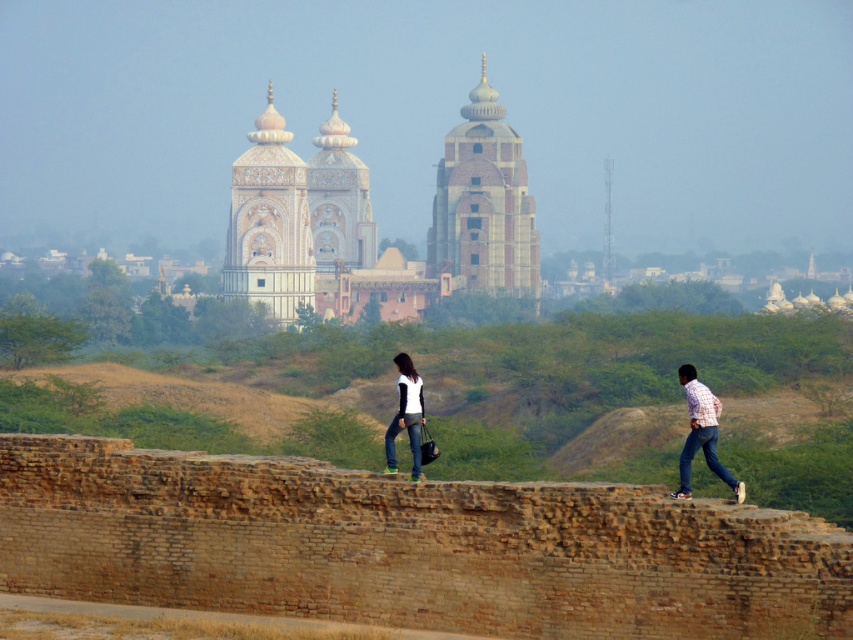
Question: Does white marble tower at center appear on the left side of checkered shirt jeans at right?

Choices:
 (A) no
 (B) yes

Answer: (B)

Question: Estimate the real-world distances between objects in this image. Which object is farther from the jeans at center?

Choices:
 (A) matte white shirt at center
 (B) checkered shirt jeans at right

Answer: (A)

Question: Observing the image, what is the correct spatial positioning of brick tower at center in reference to matte white shirt at center?

Choices:
 (A) below
 (B) above

Answer: (B)

Question: Based on their relative distances, which object is nearer to the checkered shirt jeans at right?

Choices:
 (A) jeans at center
 (B) matte white shirt at center
 (C) brick tower at center

Answer: (A)

Question: Which object is farther from the camera taking this photo?

Choices:
 (A) jeans at center
 (B) checkered shirt jeans at right

Answer: (A)

Question: Can you confirm if white marble tower at center is thinner than matte white shirt at center?

Choices:
 (A) no
 (B) yes

Answer: (A)